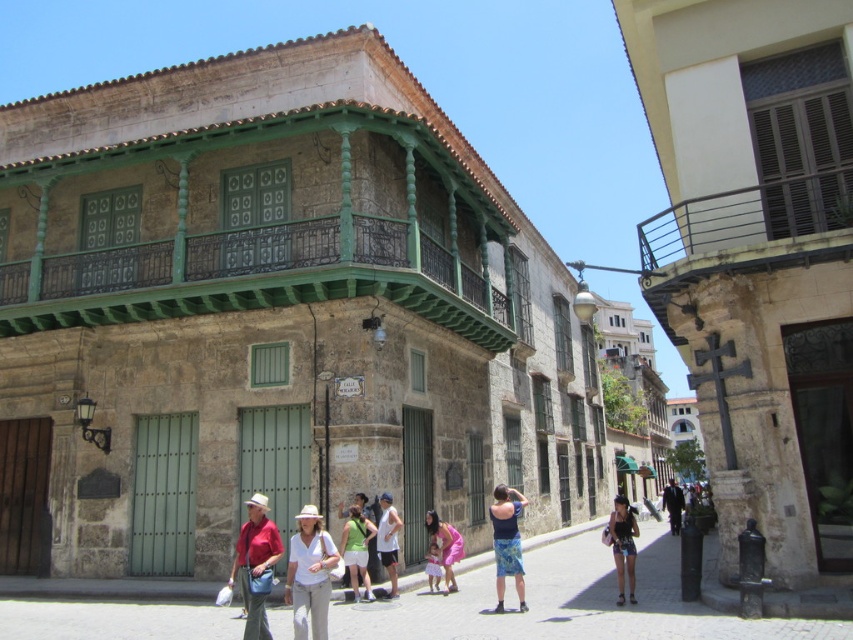
Question: Which point is closer to the camera taking this photo?

Choices:
 (A) (628, 595)
 (B) (490, 518)

Answer: (A)

Question: Is the position of blue denim shorts at center more distant than that of denim shorts at lower right?

Choices:
 (A) yes
 (B) no

Answer: (B)

Question: Does white cotton tank top at center have a greater width compared to dark blue jeans at center?

Choices:
 (A) yes
 (B) no

Answer: (B)

Question: Among these objects, which one is nearest to the camera?

Choices:
 (A) brown metal railing at upper right
 (B) matte red shirt at center
 (C) blue denim shorts at center

Answer: (B)

Question: Is stone paved alley at center to the left of green painted wood at upper center from the viewer's perspective?

Choices:
 (A) yes
 (B) no

Answer: (B)

Question: Which of the following is the farthest from the observer?

Choices:
 (A) white matte hat at center
 (B) matte red shirt at center
 (C) white cotton tank top at center
 (D) brown metal railing at upper right

Answer: (C)